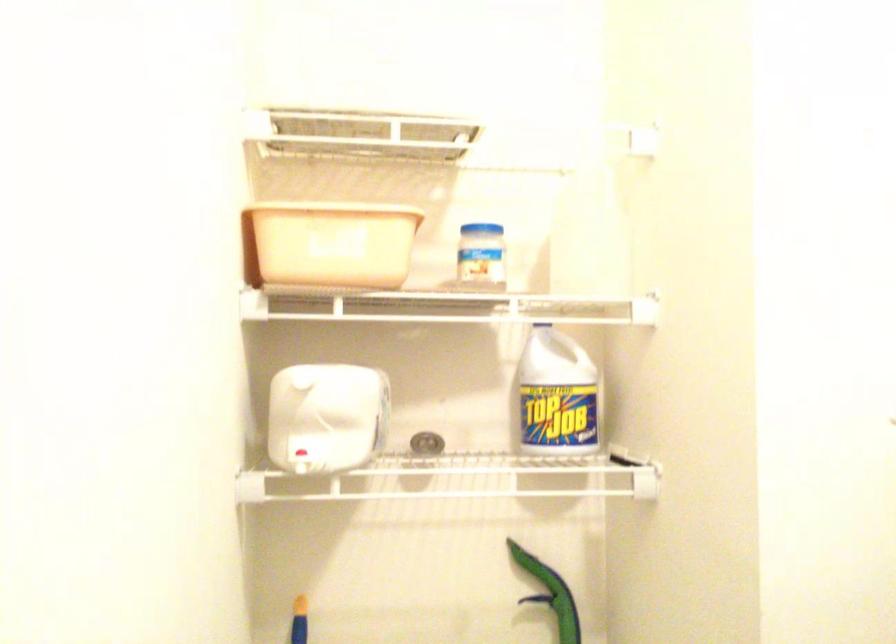
This screenshot has width=896, height=644. What do you see at coordinates (299, 462) in the screenshot?
I see `the red jug spout` at bounding box center [299, 462].